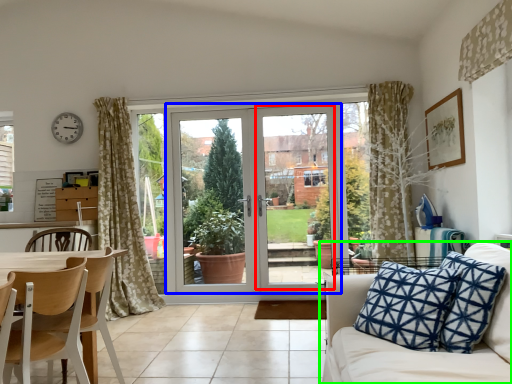
Question: Which object is the farthest from screen door (highlighted by a red box)? Choose among these: door (highlighted by a blue box) or studio couch (highlighted by a green box).

Choices:
 (A) door
 (B) studio couch

Answer: (B)